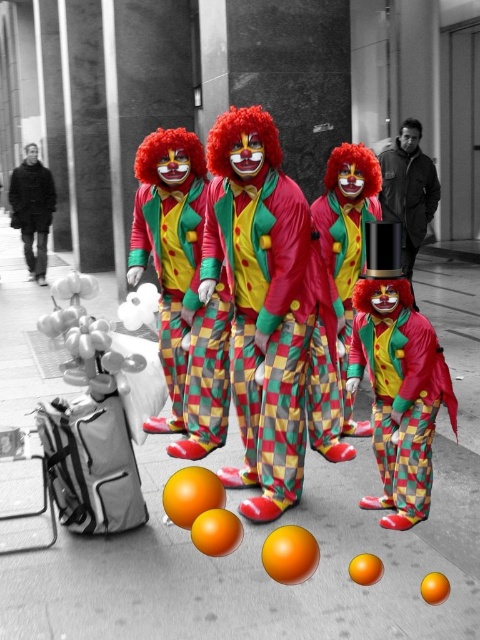
Which of these two, smooth concrete pavement at center or matte clown at center, stands shorter?

With less height is smooth concrete pavement at center.

Can you confirm if smooth concrete pavement at center is positioned above matte clown at center?

No, smooth concrete pavement at center is not above matte clown at center.

Is point (468, 353) less distant than point (303, 317)?

No, it is not.

The height and width of the screenshot is (640, 480). I want to click on smooth concrete pavement at center, so click(x=273, y=528).